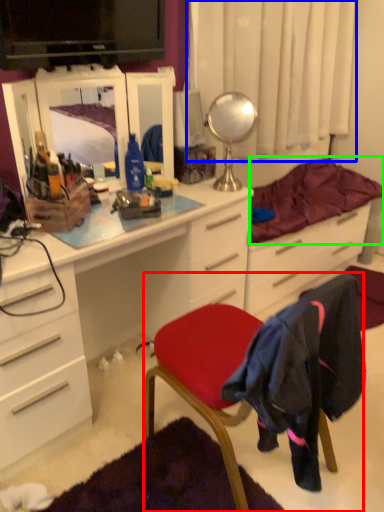
Question: Which is nearer to the chair (highlighted by a red box)? curtain (highlighted by a blue box) or bedding (highlighted by a green box).

Choices:
 (A) curtain
 (B) bedding

Answer: (B)